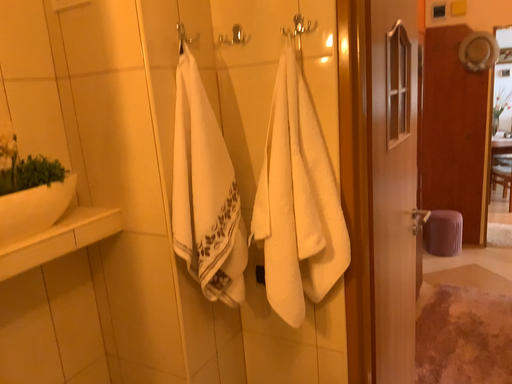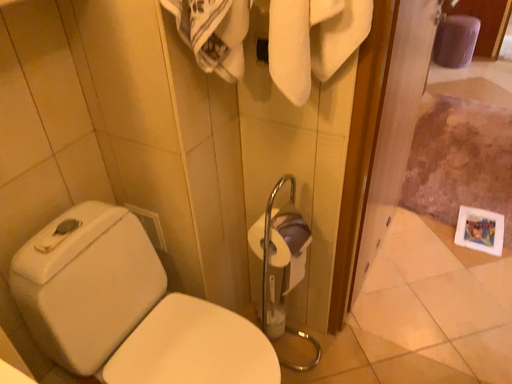
Question: How did the camera likely rotate when shooting the video?

Choices:
 (A) rotated downward
 (B) rotated upward

Answer: (A)